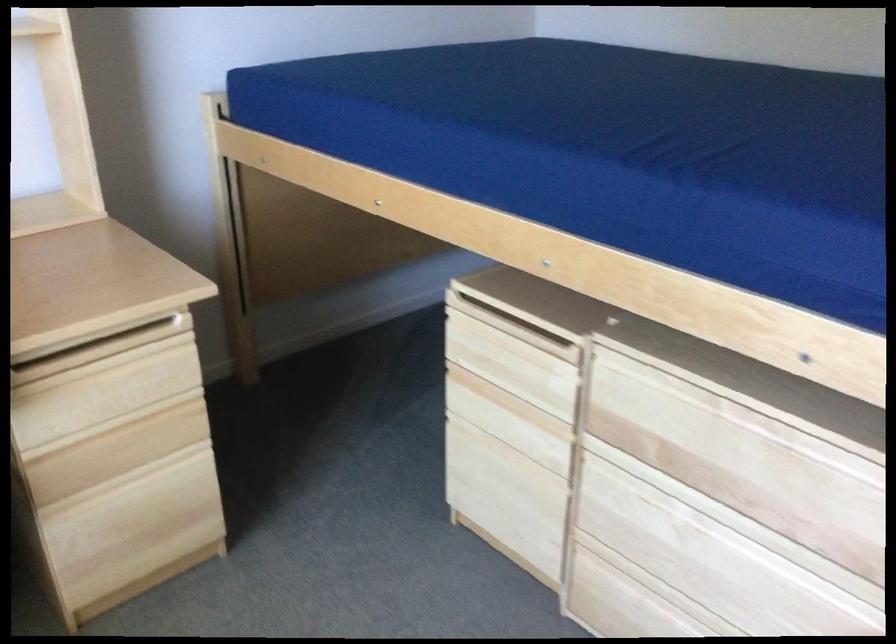
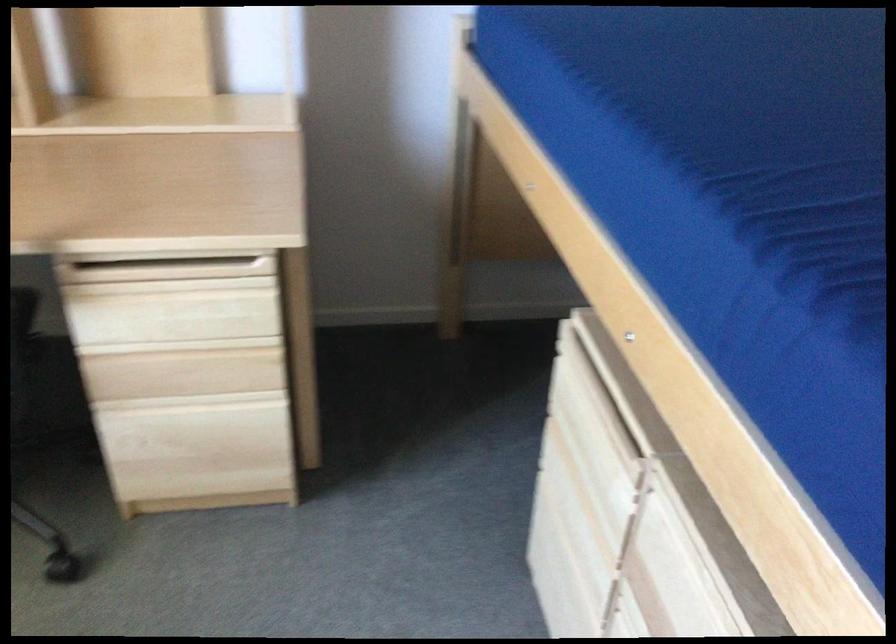
Find the pixel in the second image that matches point 97,348 in the first image.

(166, 270)